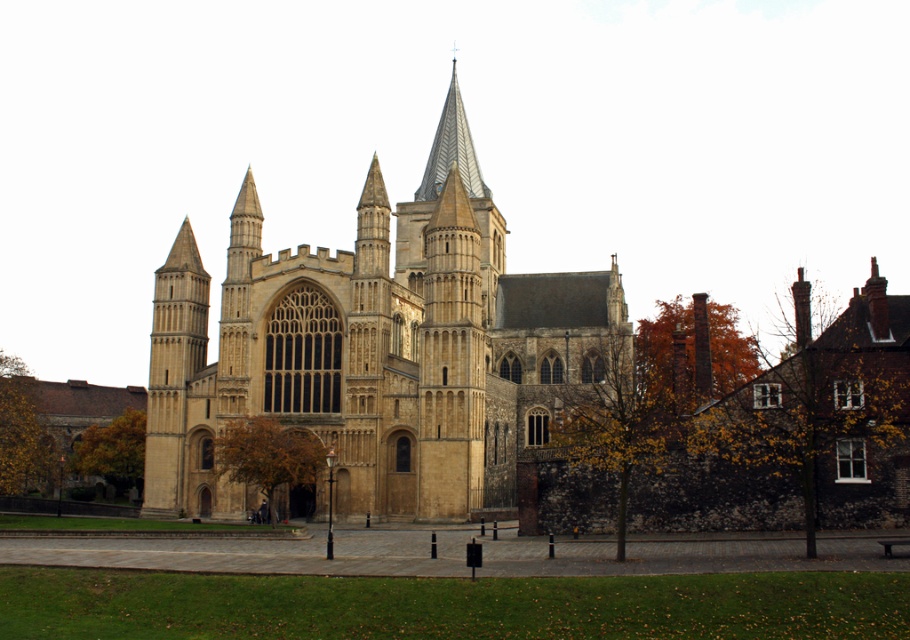
Question: Which is nearer to the orange autumn leaves at right?

Choices:
 (A) gray textured spire at center
 (B) brown leafy tree at center

Answer: (A)

Question: Is orange autumn leaves at right above gray textured spire at center?

Choices:
 (A) no
 (B) yes

Answer: (A)

Question: Is beige stone church at center to the right of golden leafy tree at lower left from the viewer's perspective?

Choices:
 (A) yes
 (B) no

Answer: (A)

Question: Which object is the closest to the yellow-green leaves at center?

Choices:
 (A) beige stone church at center
 (B) brown leafy tree at center

Answer: (A)

Question: Which of the following is the farthest from the observer?

Choices:
 (A) orange autumn leaves at right
 (B) golden leafy tree at lower left

Answer: (B)

Question: Does yellow-green leaves at center appear under orange autumn leaves at right?

Choices:
 (A) no
 (B) yes

Answer: (B)